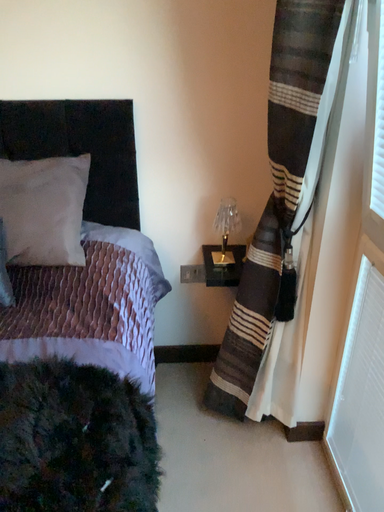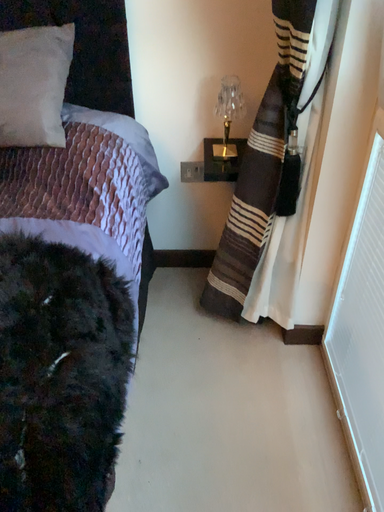
Question: Which way did the camera rotate in the video?

Choices:
 (A) rotated downward
 (B) rotated upward

Answer: (A)